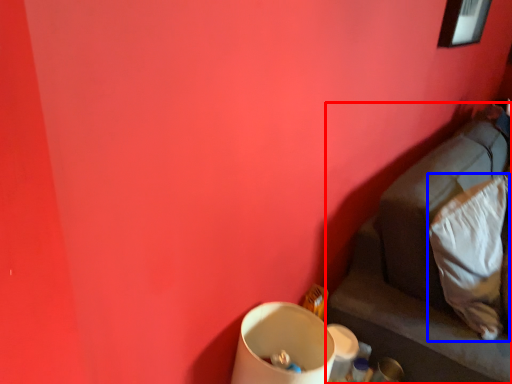
Question: Among these objects, which one is farthest to the camera, furniture (highlighted by a red box) or pillow (highlighted by a blue box)?

Choices:
 (A) furniture
 (B) pillow

Answer: (B)